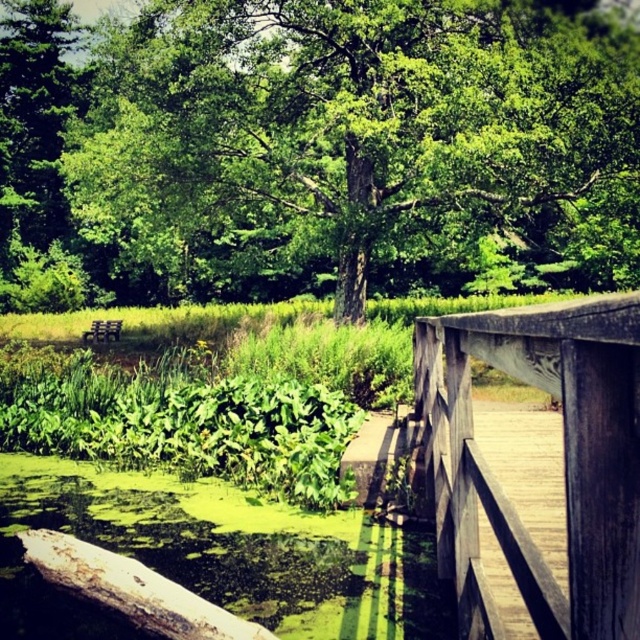
Question: Which of the following is the farthest from the observer?

Choices:
 (A) wooden rail at center
 (B) brown rough log at lower left

Answer: (B)

Question: Which point is closer to the camera taking this photo?

Choices:
 (A) (579, 320)
 (B) (157, 593)

Answer: (A)

Question: Can you confirm if green leafy tree at center is positioned to the right of brown rough log at lower left?

Choices:
 (A) no
 (B) yes

Answer: (A)

Question: Can you confirm if wooden bridge at right is wider than brown rough log at lower left?

Choices:
 (A) yes
 (B) no

Answer: (B)

Question: Among these points, which one is nearest to the camera?

Choices:
 (A) (65, 113)
 (B) (125, 573)
 (C) (634, 621)
 (D) (524, 572)

Answer: (C)

Question: Can you confirm if wooden rail at center is positioned below wooden bridge at right?

Choices:
 (A) yes
 (B) no

Answer: (B)